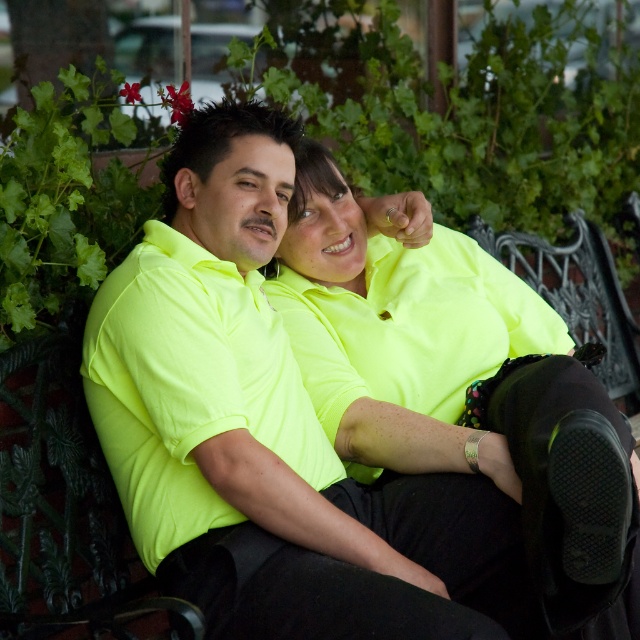
You are a photographer trying to capture the two people in the image. You want to ensure both the neon yellow shirt at center and the neon yellow polo shirt at center are clearly visible. Which clothing item should you focus on first to ensure it doesn t get lost in the background?

The neon yellow shirt at center is bigger than neon yellow polo shirt at center, so you should focus on the neon yellow polo shirt at center first to ensure it doesn t get lost in the background.

You are a photographer trying to capture a clear shot of both the neon yellow shirt at center and the neon yellow polo shirt at center. Since they are both in the same area, which one would you focus on first to ensure it appears sharp in the photo?

The neon yellow shirt at center is in front of the neon yellow polo shirt at center, so focusing on the neon yellow shirt at center first will ensure it appears sharp while the polo shirt may be slightly blurred due to depth of field.

You are standing in front of the bench and want to place a small flower pot between the two points, point 1 at point (262, 506) and point 2 at point (150, 536). Which point should you place it closer to so that it appears closer to you?

Place the flower pot closer to point (262, 506) because it is closer to the viewer than point (150, 536).